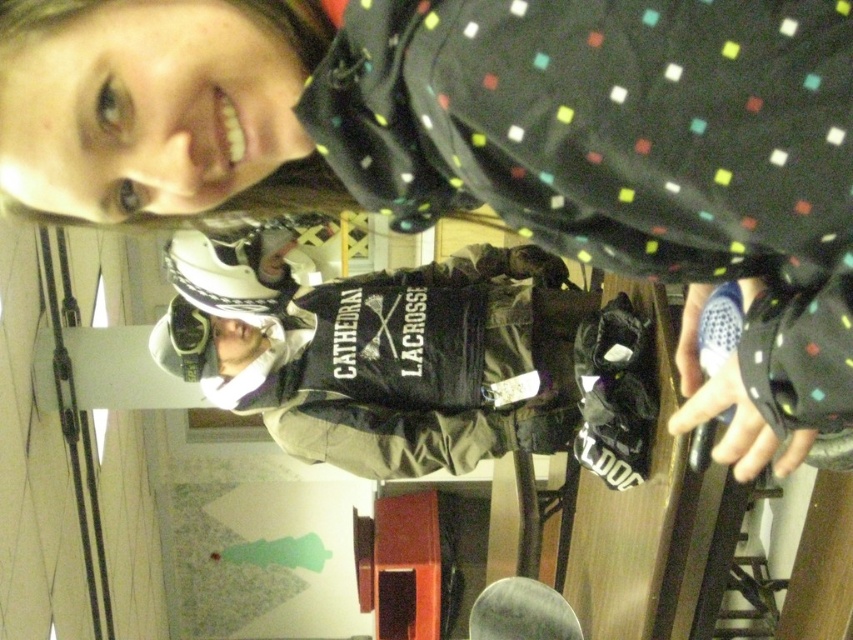
Is camouflage fabric snowboard at center below matte black goggles at center?

No.

What do you see at coordinates (422, 358) in the screenshot? This screenshot has height=640, width=853. I see `camouflage fabric snowboard at center` at bounding box center [422, 358].

Is point (428, 461) more distant than point (186, 330)?

No, it is not.

Identify the location of camouflage fabric snowboard at center. (x=422, y=358).